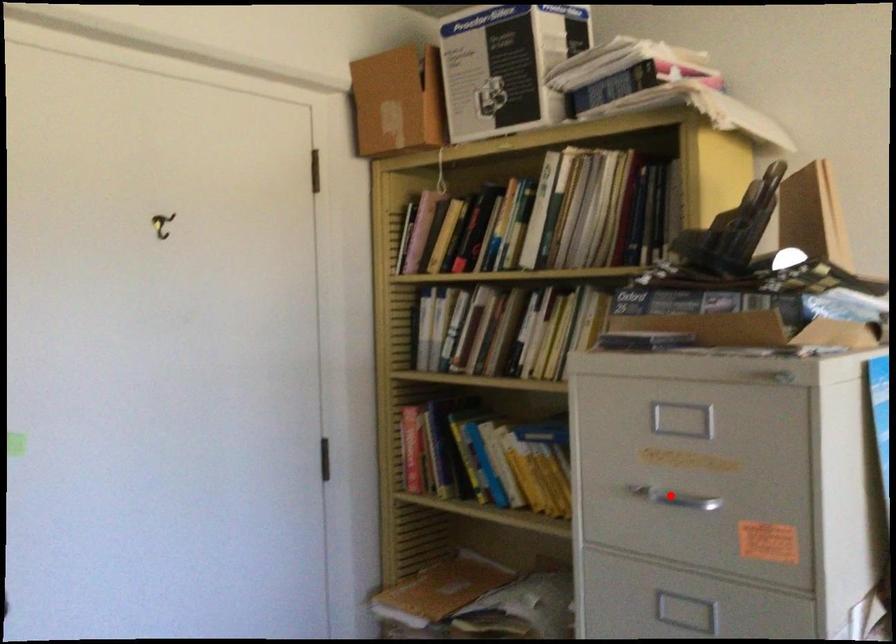
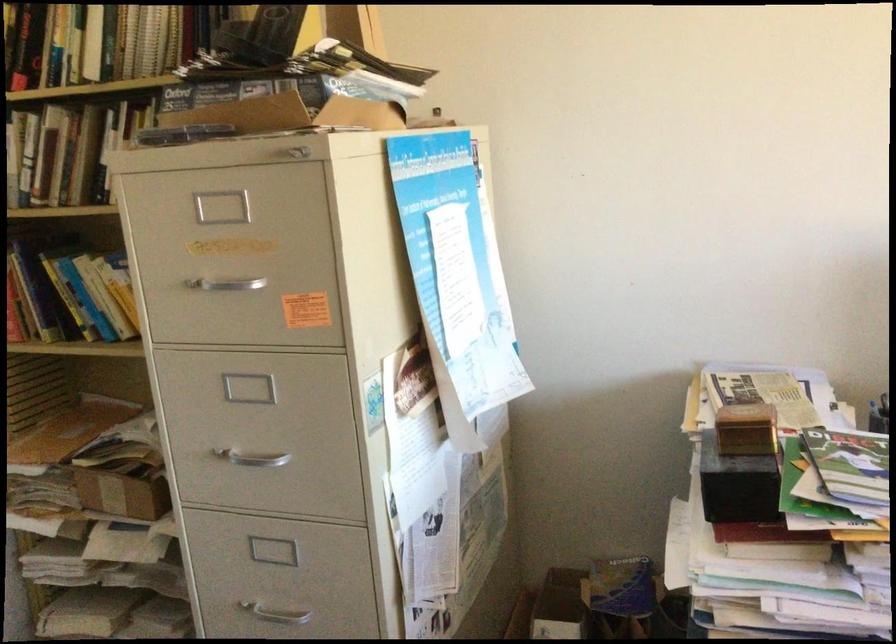
Find the pixel in the second image that matches the highlighted location in the first image.

(224, 283)